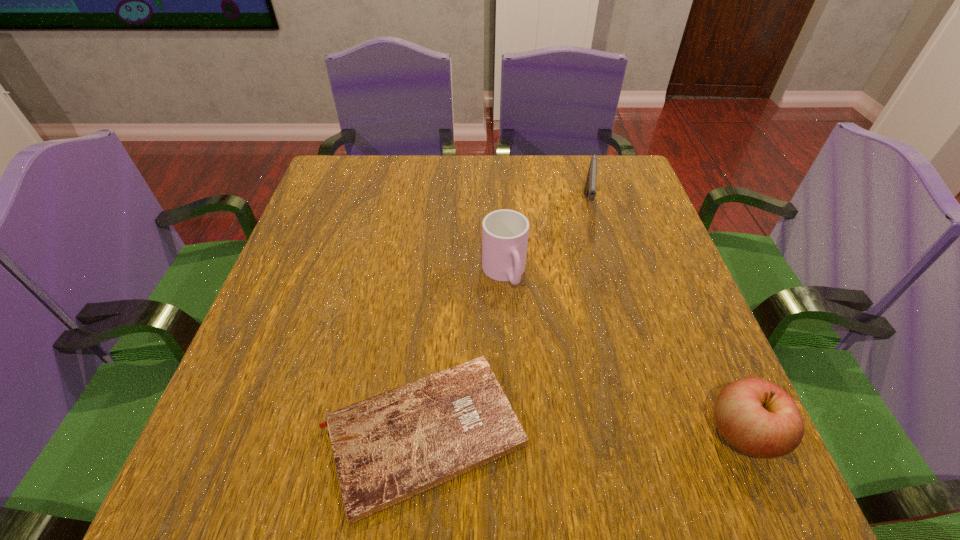
Where is `vacant point located between the pistol and the rightmost object`? The height and width of the screenshot is (540, 960). vacant point located between the pistol and the rightmost object is located at coordinates (664, 320).

At what (x,y) coordinates should I click in order to perform the action: click on empty space that is in between the cup and the shortest object. Please return your answer as a coordinate pair (x, y). This screenshot has height=540, width=960. Looking at the image, I should click on (464, 353).

Find the location of a particular element. The height and width of the screenshot is (540, 960). vacant area that lies between the apple and the pistol is located at coordinates (664, 320).

Locate an element on the screen. The width and height of the screenshot is (960, 540). blank region between the third nearest object and the pistol is located at coordinates (545, 240).

Image resolution: width=960 pixels, height=540 pixels. Identify the location of empty location between the cup and the shortest object. (464, 353).

I want to click on object identified as the third closest to the cup, so [x=757, y=417].

The height and width of the screenshot is (540, 960). I want to click on object identified as the third closest to the rightmost object, so click(590, 186).